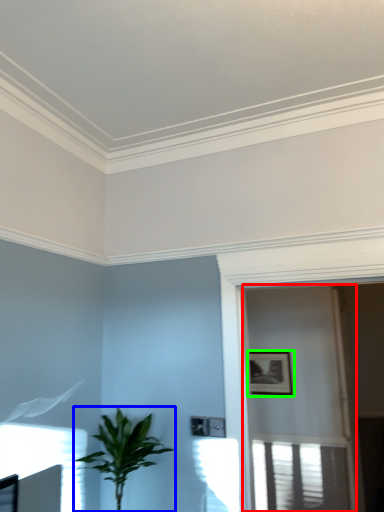
Question: Which object is the farthest from screen door (highlighted by a red box)? Choose among these: houseplant (highlighted by a blue box) or picture frame (highlighted by a green box).

Choices:
 (A) houseplant
 (B) picture frame

Answer: (A)